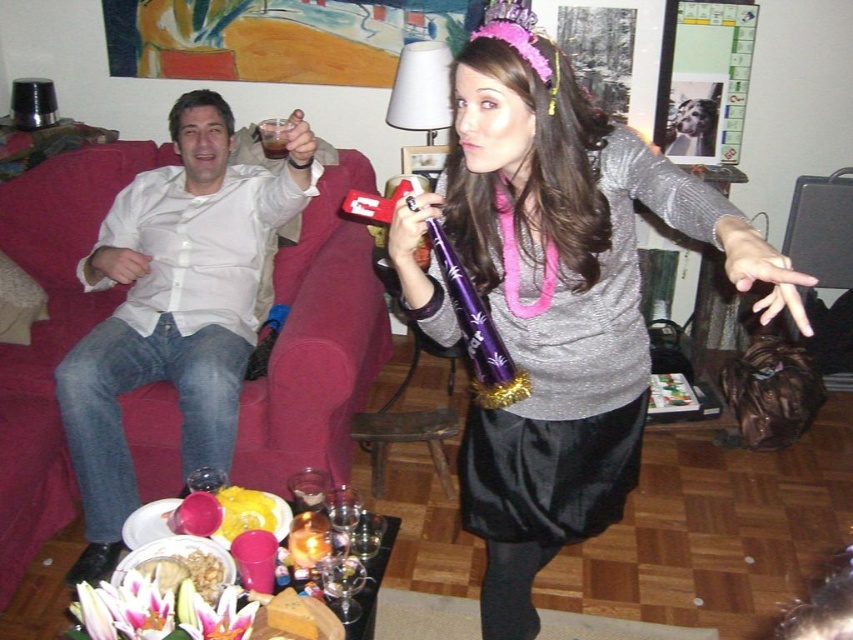
You are a photographer at the party and want to take a photo of the satin black dress at center and the brown liquid at couch left. Which object will appear larger in the photo?

The satin black dress at center will appear larger in the photo because it is closer to the viewer than the brown liquid at couch left.

You are a photographer at the party and want to take a photo of the satin black dress at center and the brown liquid at couch left. Which object should you focus on first if you want to capture both in one shot without moving the camera?

You should focus on the satin black dress at center first because it is taller than the brown liquid at couch left, so it will be more prominent in the frame.